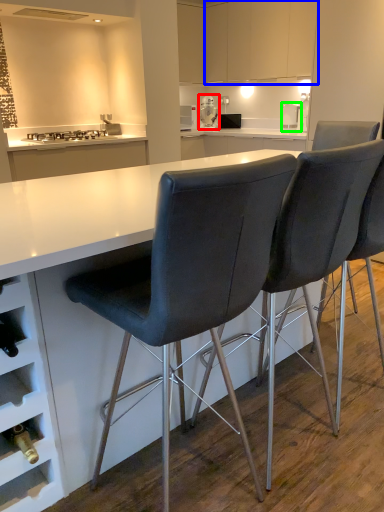
Question: Which object is the closest to the appliance (highlighted by a red box)? Choose among these: cabinetry (highlighted by a blue box) or kitchen appliance (highlighted by a green box).

Choices:
 (A) cabinetry
 (B) kitchen appliance

Answer: (A)